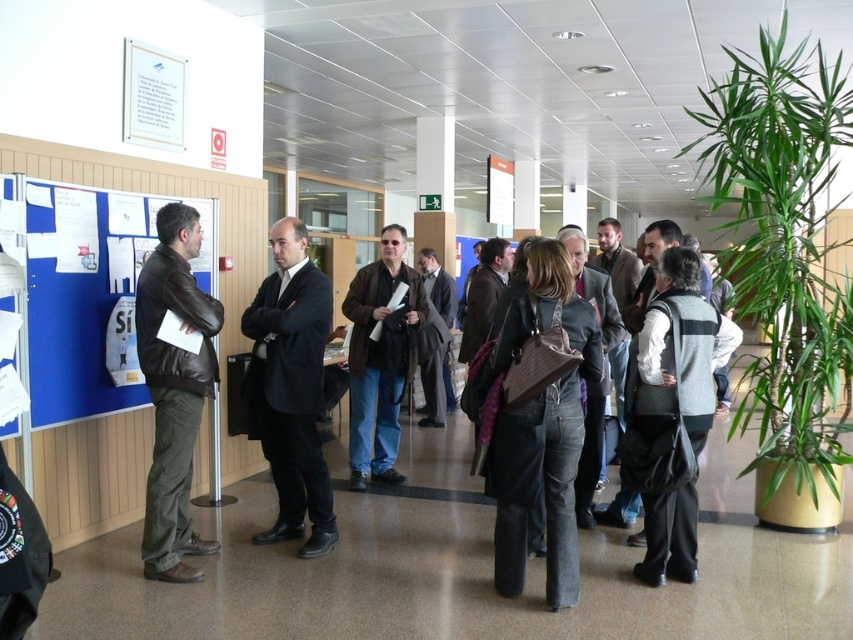
Which of these two, denim jeans at center or white glossy poster at upper left, stands taller?

Standing taller between the two is denim jeans at center.

Between denim jeans at center and white glossy poster at upper left, which one is positioned higher?

white glossy poster at upper left is above.

At what (x,y) coordinates should I click in order to perform the action: click on denim jeans at center. Please return your answer as a coordinate pair (x, y). Looking at the image, I should click on (541, 429).

You are a GUI agent. You are given a task and a screenshot of the screen. Output one action in this format:
    pyautogui.click(x=<x>, y=<y>)
    Task: Click on the denim jeans at center
    The image size is (853, 640).
    Given the screenshot: What is the action you would take?
    pyautogui.click(x=541, y=429)

The height and width of the screenshot is (640, 853). Find the location of `blue fabric bulletin board at left`. blue fabric bulletin board at left is located at coordinates (83, 298).

At what (x,y) coordinates should I click in order to perform the action: click on blue fabric bulletin board at left. Please return your answer as a coordinate pair (x, y). This screenshot has width=853, height=640. Looking at the image, I should click on (83, 298).

Does matte brown leather jacket at left appear over matte brown jacket at center?

Incorrect, matte brown leather jacket at left is not positioned above matte brown jacket at center.

Is the position of matte brown leather jacket at left more distant than that of matte brown jacket at center?

No, it is not.

Who is more distant from viewer, (154, 516) or (393, 314)?

The point (393, 314) is more distant.

Locate an element on the screen. The image size is (853, 640). matte brown leather jacket at left is located at coordinates point(173,390).